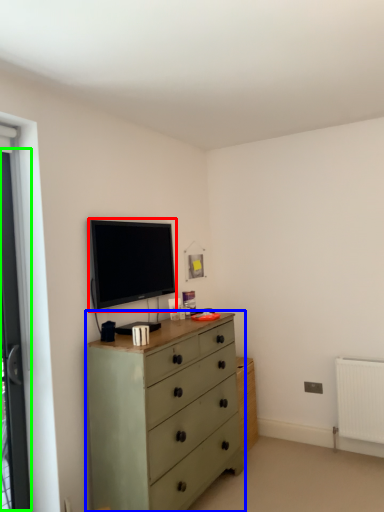
Question: Which is farther away from television (highlighted by a red box)? chest of drawers (highlighted by a blue box) or screen door (highlighted by a green box)?

Choices:
 (A) chest of drawers
 (B) screen door

Answer: (B)